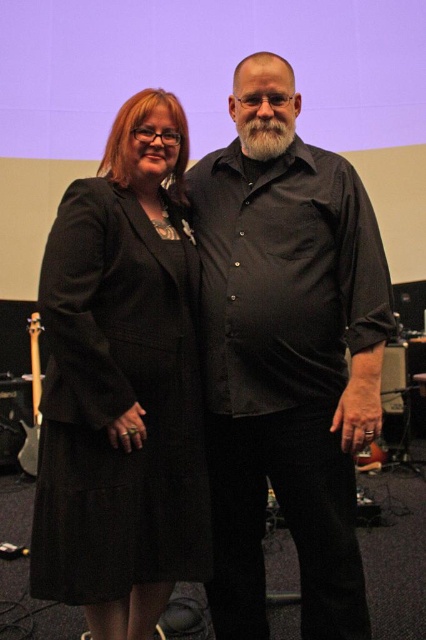
Question: Among these objects, which one is nearest to the camera?

Choices:
 (A) matte black guitar at lower left
 (B) white soft beard at center
 (C) matte black shirt at center

Answer: (C)

Question: Which of the following is the farthest from the observer?

Choices:
 (A) matte black shirt at center
 (B) matte black guitar at lower left

Answer: (B)

Question: Is matte black dress at left further to camera compared to matte black guitar at lower left?

Choices:
 (A) yes
 (B) no

Answer: (B)

Question: Based on their relative distances, which object is farther from the matte black shirt at center?

Choices:
 (A) matte black dress at left
 (B) matte black guitar at lower left
 (C) white soft beard at center

Answer: (B)

Question: Can you confirm if matte black shirt at center is positioned above white soft beard at center?

Choices:
 (A) no
 (B) yes

Answer: (A)

Question: Does matte black shirt at center appear under white soft beard at center?

Choices:
 (A) yes
 (B) no

Answer: (A)